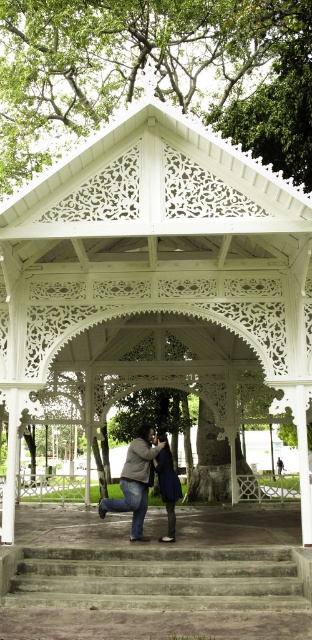
Who is taller, white carved wood gazebo at center or matte black suit at center?

white carved wood gazebo at center

Which is more to the right, white carved wood gazebo at center or matte black suit at center?

From the viewer's perspective, white carved wood gazebo at center appears more on the right side.

Locate an element on the screen. The width and height of the screenshot is (312, 640). white carved wood gazebo at center is located at coordinates (156, 275).

Identify the location of white carved wood gazebo at center. (156, 275).

Does white carved wood gazebo at center appear under concrete stairs at lower center?

No, white carved wood gazebo at center is not below concrete stairs at lower center.

Find the location of a particular element. The height and width of the screenshot is (640, 312). white carved wood gazebo at center is located at coordinates click(x=156, y=275).

Describe the element at coordinates (156, 275) in the screenshot. I see `white carved wood gazebo at center` at that location.

This screenshot has width=312, height=640. In order to click on white carved wood gazebo at center in this screenshot , I will do `click(156, 275)`.

Between matte black suit at center and dark blue fabric dress at center, which one has less height?

dark blue fabric dress at center is shorter.

The height and width of the screenshot is (640, 312). What do you see at coordinates (141, 481) in the screenshot?
I see `matte black suit at center` at bounding box center [141, 481].

Image resolution: width=312 pixels, height=640 pixels. I want to click on matte black suit at center, so click(141, 481).